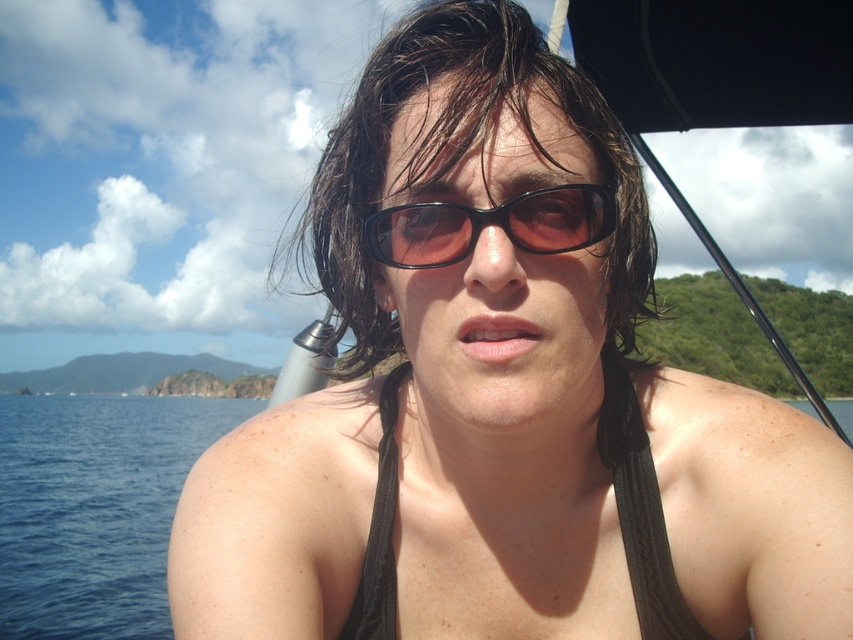
Which is in front, point (61, 468) or point (436, 225)?

Point (436, 225) is in front.

Which is behind, point (163, 628) or point (467, 232)?

Positioned behind is point (163, 628).

Which is behind, point (70, 518) or point (543, 218)?

Positioned behind is point (70, 518).

The height and width of the screenshot is (640, 853). I want to click on blue water at lower left, so click(96, 508).

Does transparent water at center have a lesser height compared to black fabric bikini top at center?

No.

Between transparent water at center and black fabric bikini top at center, which one has more height?

With more height is transparent water at center.

At what (x,y) coordinates should I click in order to perform the action: click on transparent water at center. Please return your answer as a coordinate pair (x, y). Looking at the image, I should click on (96, 508).

Which is in front, point (155, 600) or point (161, 492)?

Point (155, 600) is more forward.

Does transparent water at center have a larger size compared to blue water at lower left?

Indeed, transparent water at center has a larger size compared to blue water at lower left.

Does point (67, 506) come behind point (107, 440)?

No.

Locate an element on the screen. transparent water at center is located at coordinates (96, 508).